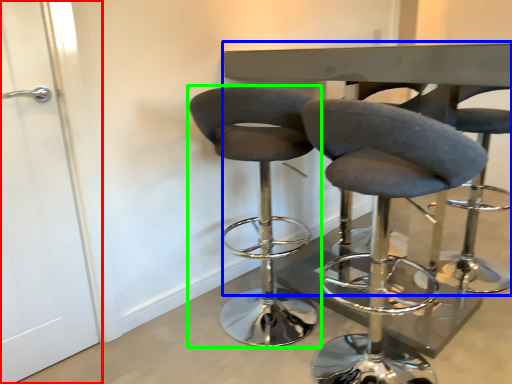
Question: Which is nearer to the screen door (highlighted by a red box)? round table (highlighted by a blue box) or chair (highlighted by a green box).

Choices:
 (A) round table
 (B) chair

Answer: (B)